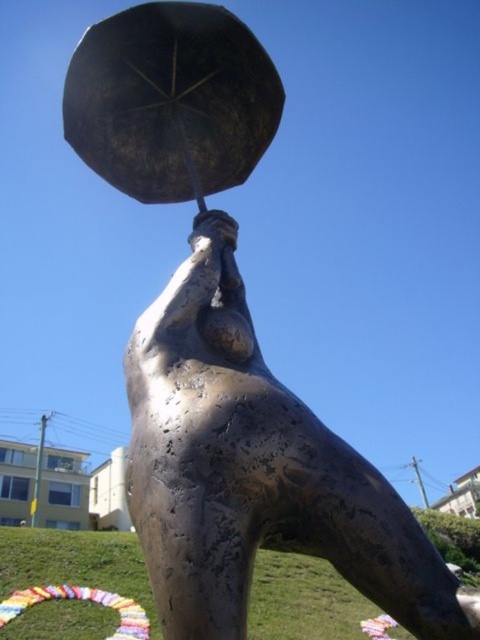
You are a park visitor who wants to take a photo of the bronze statue at center and the shiny bronze umbrella at upper center. Since the statue is larger, will you need to adjust your camera settings to focus on both objects equally?

The bronze statue at center is larger than the shiny bronze umbrella at upper center, so you should position yourself closer to the statue to ensure both objects appear balanced in the photo.

You are standing in a park and see the bronze statue at center and the shiny bronze umbrella at upper center. Which object is closer to you?

The bronze statue at center is closer to you because it is in front of the shiny bronze umbrella at upper center.